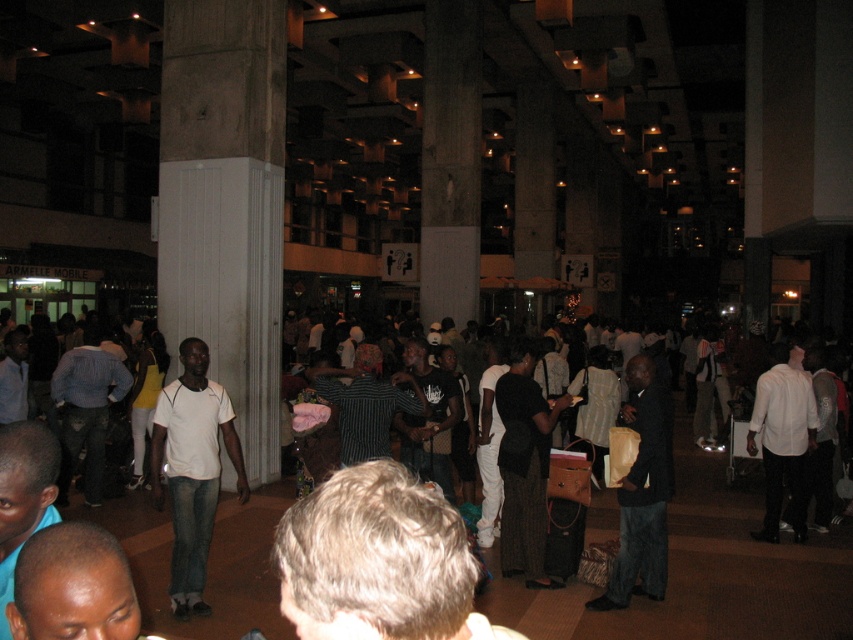
You are standing in the middle of the room and want to take a photo. There are two points marked in the scene, point 1 at coordinates point (212, 451) and point 2 at coordinates point (669, 468). Which point is closer to your current position?

Point (212, 451) is closer to the camera than point (669, 468), so it is closer to your current position.